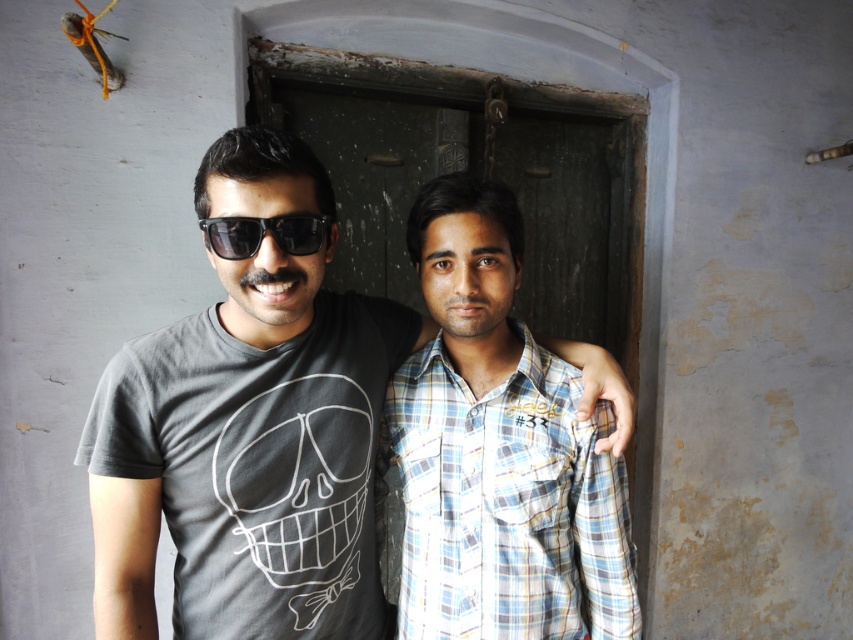
Is the position of gray matte t-shirt at center more distant than that of plaid shirt at center?

No, it is not.

Who is more forward, (x=328, y=256) or (x=514, y=232)?

Point (x=328, y=256)

Is point (302, 552) farther from camera compared to point (485, 628)?

No.

Image resolution: width=853 pixels, height=640 pixels. I want to click on gray matte t-shirt at center, so click(x=248, y=429).

Which of these two, plaid shirt at center or black plastic sunglasses at center, stands taller?

Standing taller between the two is plaid shirt at center.

Can you confirm if plaid shirt at center is thinner than black plastic sunglasses at center?

Incorrect, plaid shirt at center's width is not less than black plastic sunglasses at center's.

Does point (479, 598) come farther from viewer compared to point (299, 253)?

Yes, point (479, 598) is behind point (299, 253).

Locate an element on the screen. This screenshot has width=853, height=640. plaid shirt at center is located at coordinates (498, 449).

Is point (273, 244) less distant than point (206, 227)?

Yes.

Which is below, gray matte t-shirt at center or black plastic sunglasses at center?

gray matte t-shirt at center

What do you see at coordinates (248, 429) in the screenshot? Image resolution: width=853 pixels, height=640 pixels. I see `gray matte t-shirt at center` at bounding box center [248, 429].

Find the location of `gray matte t-shirt at center`. gray matte t-shirt at center is located at coordinates (248, 429).